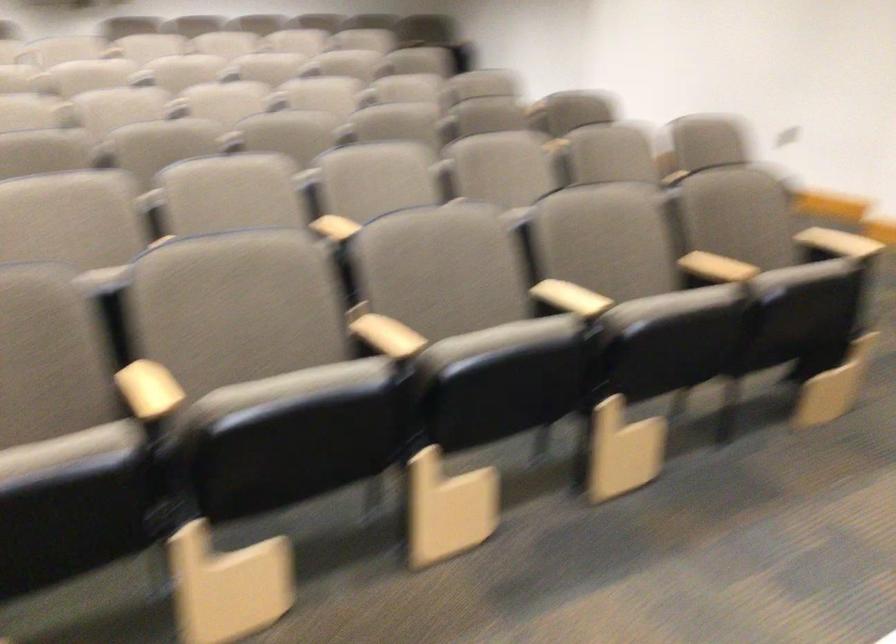
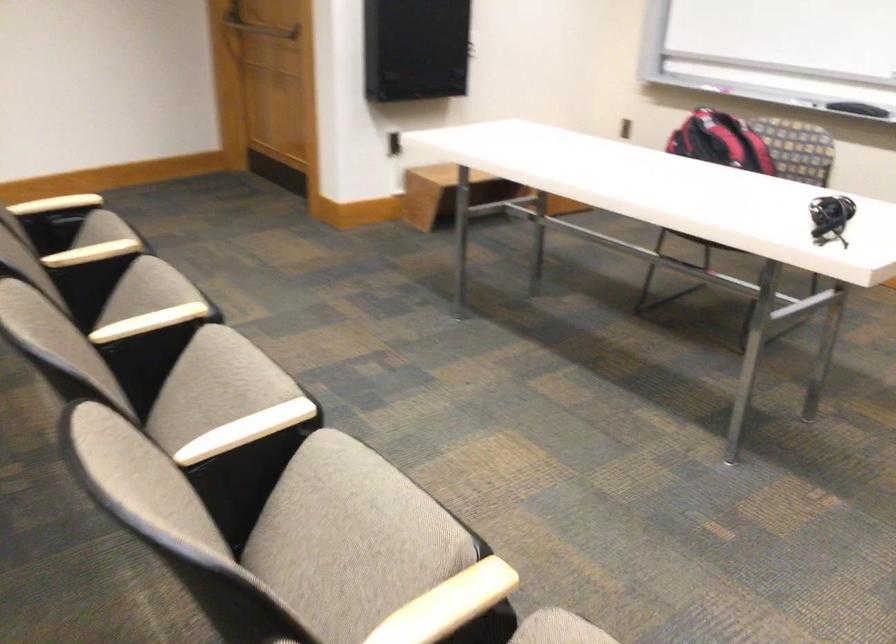
In the second image, find the point that corresponds to point (382, 343) in the first image.

(245, 430)